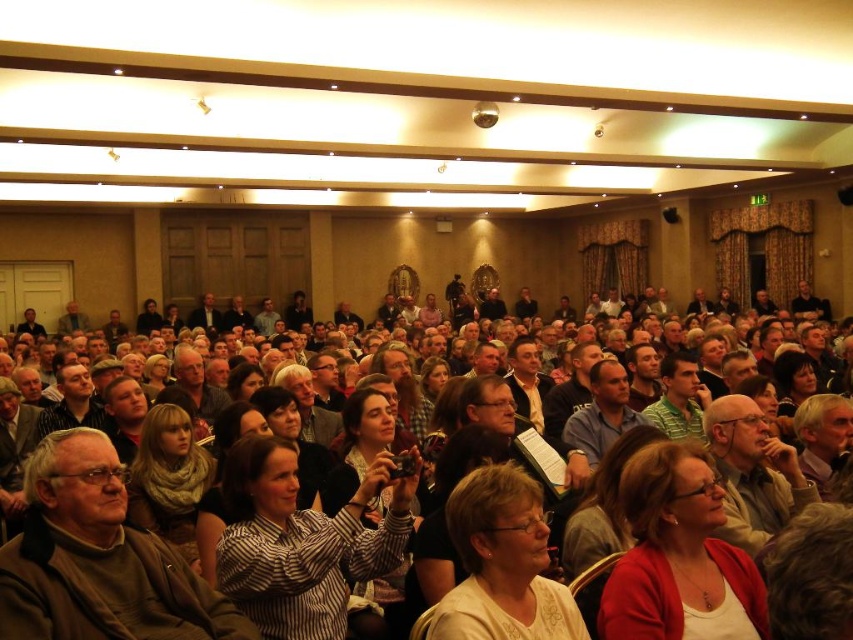
You are sitting at the back of the hall and want to see the speaker at the front. There are two people in front of you wearing a matte red cardigan at center and a light beige shirt at center. Which person is blocking your view more?

The matte red cardigan at center is blocking your view more because it is closer to you than the light beige shirt at center.

You are sitting at the back of the room and want to see the speaker at the front. There are two people in front of you with a striped shirt at center and a matte red cardigan at center. Which one is blocking your view more?

The striped shirt at center is closer to the viewer than the matte red cardigan at center, so the striped shirt at center is blocking your view more.